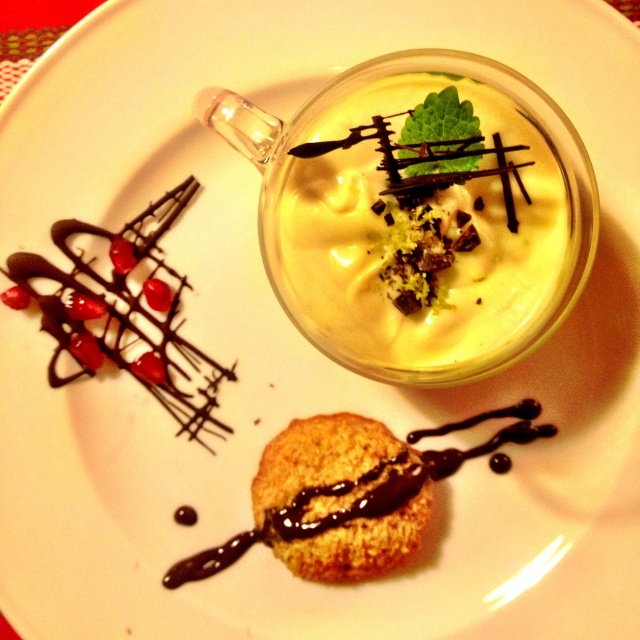
Where is the yellow creamy pudding at center located in the image?

The yellow creamy pudding at center is located at point (422, 224).

You are a food critic standing 15 inches away from the yellow creamy pudding at center. Can you reach it without moving closer?

The yellow creamy pudding at center is 14.80 inches away from the viewer, so yes, you can reach it without moving closer since you are standing exactly at 15 inches away.

You are a food critic analyzing the dessert plate. There are two points marked on the plate, point [561,200] and point [413,484]. Which point is closer to the viewer?

Point [561,200] is closer to the viewer than point [413,484].